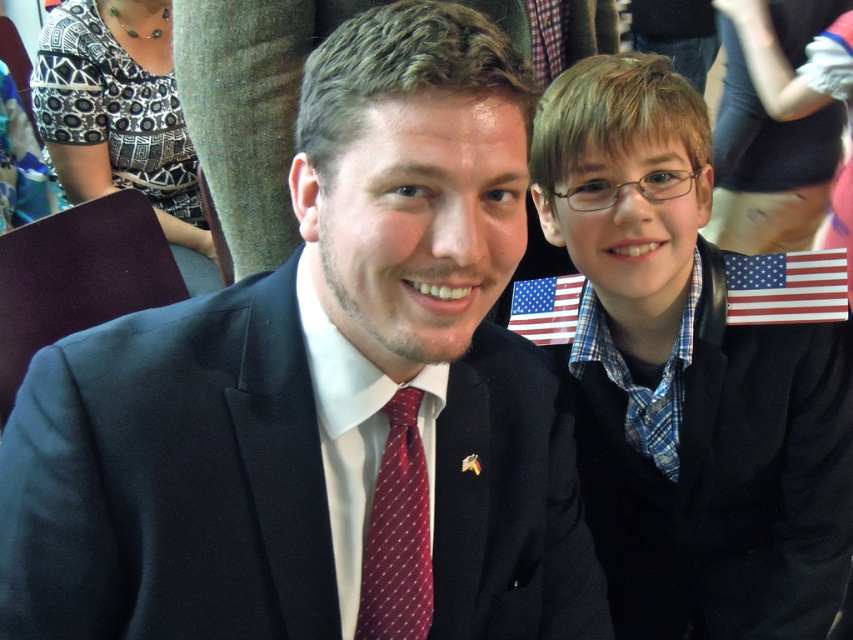
From the picture: You are standing in front of a photo of two people. There are two points marked in the image. The first point is at coordinates point [90,364] and the second point is at point [585,516]. Which point is closer to you?

Point [90,364] is closer to the viewer than point [585,516].

What object is located at the coordinates point (323, 396)?

The point (323, 396) corresponds to the matte black suit at center.

You are a photographer at a formal event. You need to place a small decorative flag exactly where the blue plaid shirt at center is located. What are the coordinates where you should place the flag?

The coordinates for placing the flag should be at point (688,378), as that is where the blue plaid shirt at center is located.